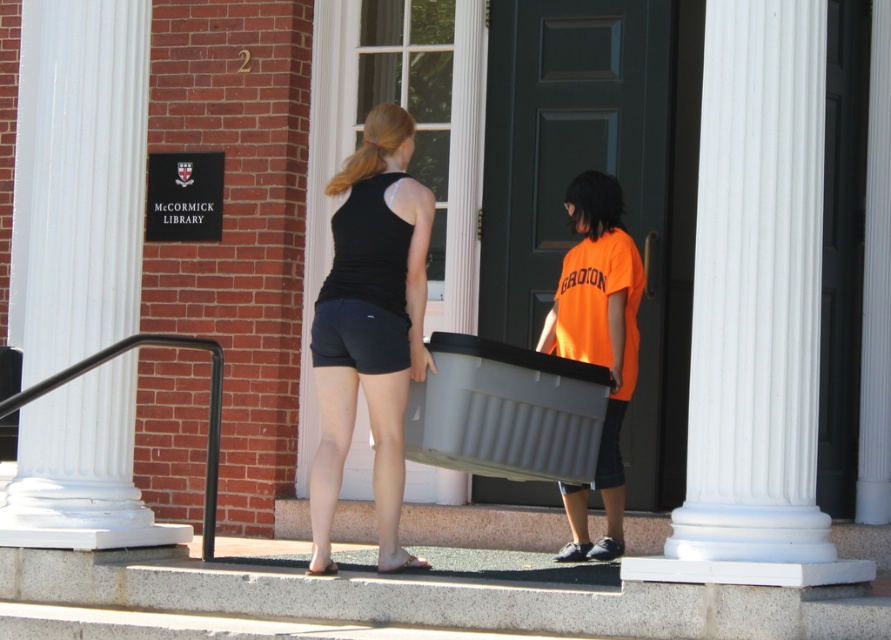
Question: Does black matte tank top at center appear under black metal handrail at lower left?

Choices:
 (A) yes
 (B) no

Answer: (B)

Question: Is white smooth column at center above black matte tank top at center?

Choices:
 (A) yes
 (B) no

Answer: (A)

Question: Which of the following is the farthest from the observer?

Choices:
 (A) black metal handrail at lower left
 (B) white smooth column at center

Answer: (A)

Question: Does white glossy pillar at left have a larger size compared to orange matte shirt at center?

Choices:
 (A) no
 (B) yes

Answer: (B)

Question: Which object is the farthest from the black metal handrail at lower left?

Choices:
 (A) white smooth column at center
 (B) black matte tank top at center
 (C) white glossy pillar at left

Answer: (A)

Question: Estimate the real-world distances between objects in this image. Which object is closer to the black matte tank top at center?

Choices:
 (A) white glossy pillar at left
 (B) orange matte shirt at center

Answer: (A)